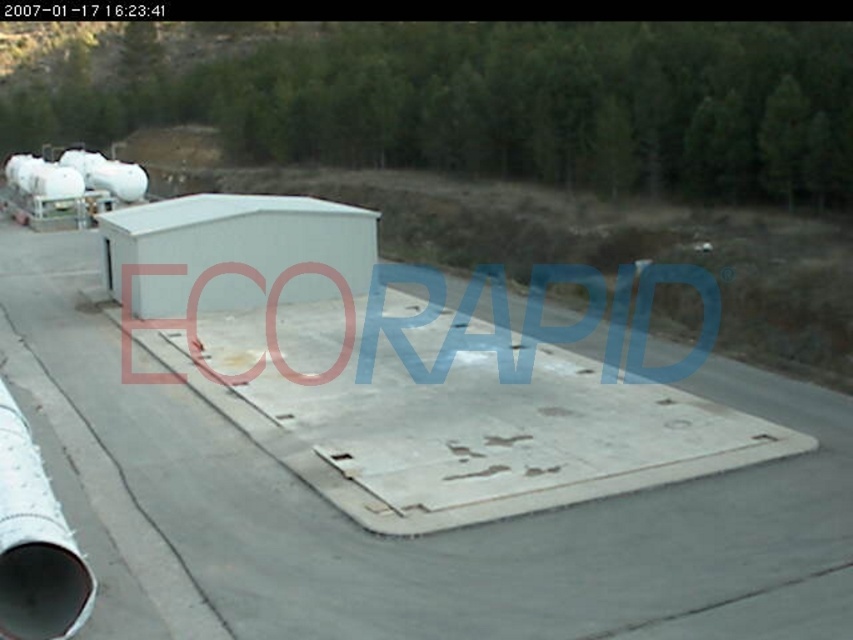
Is gray concrete tarmac at center shorter than white metallic pipe at lower left?

In fact, gray concrete tarmac at center may be taller than white metallic pipe at lower left.

Is point (15, 252) less distant than point (28, 577)?

No.

Locate an element on the screen. Image resolution: width=853 pixels, height=640 pixels. gray concrete tarmac at center is located at coordinates (450, 481).

Identify the location of gray concrete tarmac at center. Image resolution: width=853 pixels, height=640 pixels. (450, 481).

Measure the distance between point (x=624, y=525) and camera.

Point (x=624, y=525) and camera are 37.65 feet apart from each other.

Can you confirm if gray concrete tarmac at center is positioned below rusty metal ramp at center?

Incorrect, gray concrete tarmac at center is not positioned below rusty metal ramp at center.

Where is `gray concrete tarmac at center`? This screenshot has height=640, width=853. gray concrete tarmac at center is located at coordinates (450, 481).

Describe the element at coordinates (480, 435) in the screenshot. I see `rusty metal ramp at center` at that location.

Locate an element on the screen. The height and width of the screenshot is (640, 853). rusty metal ramp at center is located at coordinates (480, 435).

This screenshot has height=640, width=853. I want to click on rusty metal ramp at center, so click(x=480, y=435).

The height and width of the screenshot is (640, 853). What are the coordinates of `rusty metal ramp at center` in the screenshot? It's located at (480, 435).